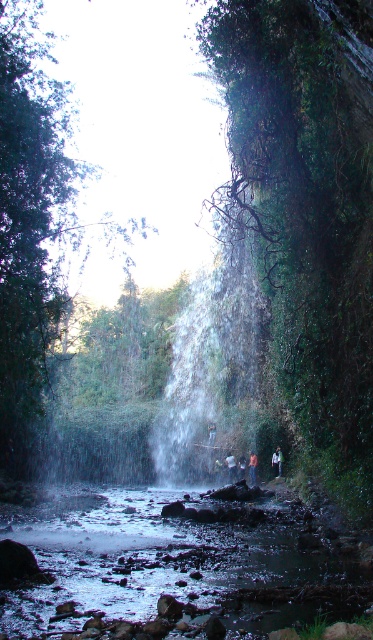
You are standing at the bottom of the waterfall and see the light blue denim jacket at center. If you want to reach the jacket, which direction should you move relative to the waterfall?

The light blue denim jacket at center is located at point 0.722 on the x axis and 0.743 on the y axis. Since you are at the bottom of the waterfall, you should move towards the center area where the jacket is positioned.

You are standing at the edge of the shallow pool at the base of the waterfall and see both the dark blue jeans at center and the blue denim jeans at center. Which pair of jeans is taller?

The dark blue jeans at center is taller than the blue denim jeans at center according to the description.